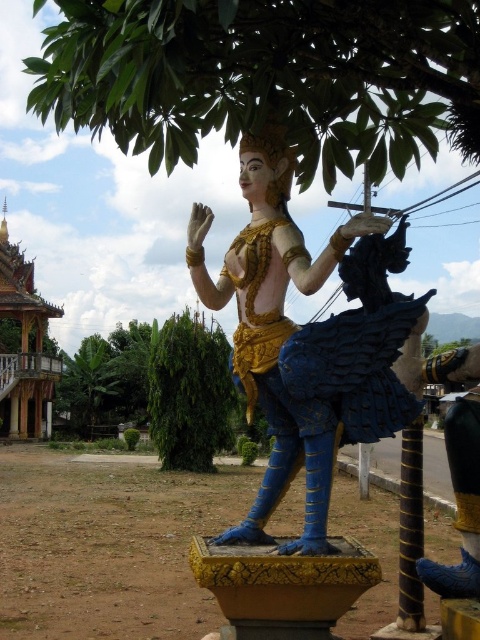
Question: Among these points, which one is nearest to the camera?

Choices:
 (A) click(71, 397)
 (B) click(210, 420)
 (C) click(280, 291)

Answer: (C)

Question: Which object is the closest to the green leafy tree at upper center?

Choices:
 (A) green leafy tree at lower left
 (B) green leafy tree at center

Answer: (B)

Question: Estimate the real-world distances between objects in this image. Which object is closer to the gold textured statue at center?

Choices:
 (A) green leafy tree at upper center
 (B) green leafy tree at lower left
 (C) green leafy tree at center

Answer: (A)

Question: Does gold textured statue at center have a greater width compared to green leafy tree at center?

Choices:
 (A) yes
 (B) no

Answer: (B)

Question: Can you confirm if gold textured statue at center is smaller than green leafy tree at lower left?

Choices:
 (A) yes
 (B) no

Answer: (A)

Question: Is gold textured statue at center closer to camera compared to green leafy tree at lower left?

Choices:
 (A) yes
 (B) no

Answer: (A)